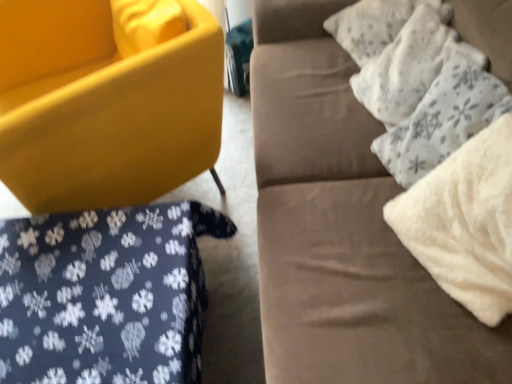
Question: Is white fluffy pillow at upper right, which is the 2th pillow from top to bottom, surrounded by matte yellow chair at lower left?

Choices:
 (A) yes
 (B) no

Answer: (B)

Question: From a real-world perspective, is matte yellow chair at lower left positioned over white fluffy pillow at upper right, acting as the 1th pillow starting from the bottom, based on gravity?

Choices:
 (A) yes
 (B) no

Answer: (B)

Question: Is matte yellow chair at lower left next to white fluffy pillow at upper right, which is the 2th pillow from top to bottom?

Choices:
 (A) no
 (B) yes

Answer: (A)

Question: Is matte yellow chair at lower left turned away from white fluffy pillow at upper right, which is the 2th pillow from top to bottom?

Choices:
 (A) yes
 (B) no

Answer: (B)

Question: From a real-world perspective, is matte yellow chair at lower left under white fluffy pillow at upper right, which is the 2th pillow from top to bottom?

Choices:
 (A) no
 (B) yes

Answer: (B)

Question: Is matte yellow chair at lower left positioned far away from white fluffy pillow at upper right, which is the 2th pillow from top to bottom?

Choices:
 (A) no
 (B) yes

Answer: (A)

Question: From the image's perspective, does matte yellow chair at lower left appear lower than dark blue fabric with white snowflake pattern at lower left?

Choices:
 (A) no
 (B) yes

Answer: (A)

Question: Is dark blue fabric with white snowflake pattern at lower left completely or partially inside matte yellow chair at lower left?

Choices:
 (A) no
 (B) yes

Answer: (A)

Question: Is matte yellow chair at lower left bigger than dark blue fabric with white snowflake pattern at lower left?

Choices:
 (A) no
 (B) yes

Answer: (B)

Question: Is matte yellow chair at lower left closer to camera compared to dark blue fabric with white snowflake pattern at lower left?

Choices:
 (A) no
 (B) yes

Answer: (A)

Question: From a real-world perspective, is matte yellow chair at lower left located beneath dark blue fabric with white snowflake pattern at lower left?

Choices:
 (A) yes
 (B) no

Answer: (B)

Question: Is matte yellow chair at lower left positioned beyond the bounds of dark blue fabric with white snowflake pattern at lower left?

Choices:
 (A) yes
 (B) no

Answer: (A)

Question: Is suede couch at upper right turned away from matte yellow chair at lower left?

Choices:
 (A) yes
 (B) no

Answer: (B)